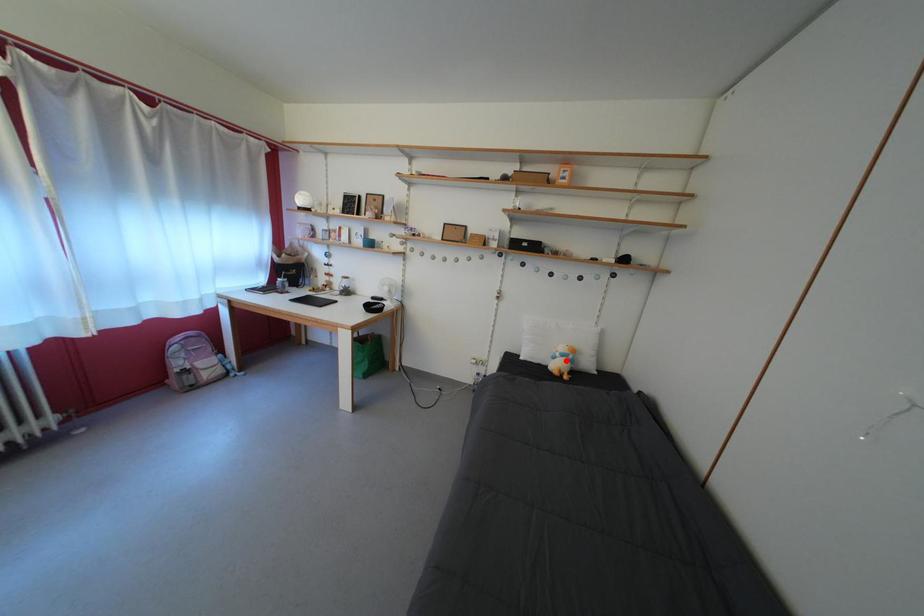
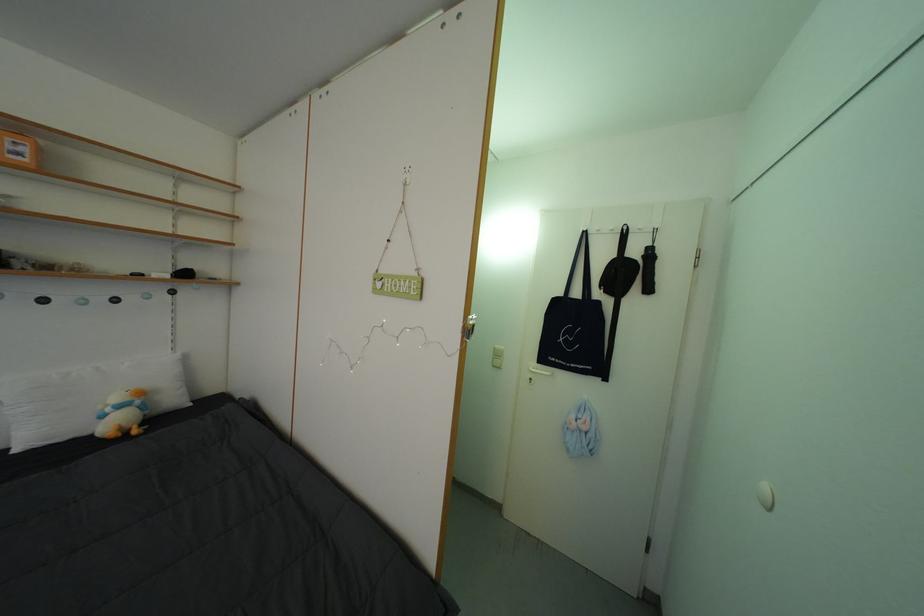
Question: I am providing you with two images of the same scene from different viewpoints. A red point is marked on the first image. At the location where the point appears in image 1, is it still visible in image 2?

Choices:
 (A) Yes
 (B) No

Answer: (A)